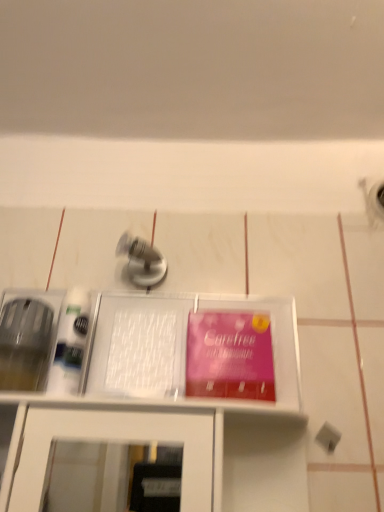
This screenshot has width=384, height=512. In order to click on satin nickel faucet at center in this screenshot , I will do `click(142, 260)`.

The height and width of the screenshot is (512, 384). What do you see at coordinates (160, 399) in the screenshot?
I see `white plastic tray at center` at bounding box center [160, 399].

Where is `satin nickel faucet at center`? This screenshot has width=384, height=512. satin nickel faucet at center is located at coordinates (142, 260).

Which of these two, satin nickel faucet at center or pink matte paper at center, is smaller?

pink matte paper at center.

Is satin nickel faucet at center directly adjacent to pink matte paper at center?

No, satin nickel faucet at center is not next to pink matte paper at center.

Measure the distance from satin nickel faucet at center to pink matte paper at center.

They are 7.96 inches apart.

How many degrees apart are the facing directions of satin nickel faucet at center and pink matte paper at center?

The angle between the facing direction of satin nickel faucet at center and the facing direction of pink matte paper at center is 0.884 degrees.

Can you confirm if white plastic tray at center is shorter than satin nickel faucet at center?

Incorrect, the height of white plastic tray at center does not fall short of that of satin nickel faucet at center.

In the scene shown: Is white plastic tray at center far away from satin nickel faucet at center?

No, white plastic tray at center is not far from satin nickel faucet at center.

In the image, there is a satin nickel faucet at center. Where is `furniture below it (from a real-world perspective)`? This screenshot has width=384, height=512. furniture below it (from a real-world perspective) is located at coordinates (160, 399).

Is white plastic tray at center facing away from satin nickel faucet at center?

No, white plastic tray at center's orientation is not away from satin nickel faucet at center.

Considering the relative sizes of white plastic tray at center and pink matte paper at center in the image provided, is white plastic tray at center thinner than pink matte paper at center?

No, white plastic tray at center is not thinner than pink matte paper at center.

The image size is (384, 512). In the image, there is a white plastic tray at center. Find the location of `paperback book below it (from a real-world perspective)`. paperback book below it (from a real-world perspective) is located at coordinates (229, 356).

Is white plastic tray at center placed right next to pink matte paper at center?

Yes, white plastic tray at center is with pink matte paper at center.

From the image's perspective, who appears lower, pink matte paper at center or white plastic tray at center?

pink matte paper at center, from the image's perspective.

Considering the relative sizes of pink matte paper at center and white plastic tray at center in the image provided, is pink matte paper at center bigger than white plastic tray at center?

No.

Find the location of a particular element. This screenshot has width=384, height=512. furniture above the pink matte paper at center (from the image's perspective) is located at coordinates (160, 399).

From the picture: Is pink matte paper at center at the right side of white plastic tray at center?

Yes.

Is pink matte paper at center oriented away from satin nickel faucet at center?

pink matte paper at center does not have its back to satin nickel faucet at center.

Based on their sizes in the image, would you say pink matte paper at center is bigger or smaller than satin nickel faucet at center?

In the image, pink matte paper at center appears to be smaller than satin nickel faucet at center.

Looking at this image, which is more to the right, pink matte paper at center or satin nickel faucet at center?

Positioned to the right is pink matte paper at center.

From the picture: From a real-world perspective, which object rests below the other?

From a 3D spatial view, white plastic tray at center is below.

Does satin nickel faucet at center turn towards white plastic tray at center?

No, satin nickel faucet at center is not facing towards white plastic tray at center.

Considering the sizes of objects satin nickel faucet at center and white plastic tray at center in the image provided, who is smaller, satin nickel faucet at center or white plastic tray at center?

satin nickel faucet at center is smaller.

Locate an element on the screen. This screenshot has width=384, height=512. tap behind the pink matte paper at center is located at coordinates (142, 260).

The height and width of the screenshot is (512, 384). In order to click on furniture on the right of satin nickel faucet at center in this screenshot , I will do `click(160, 399)`.

Which object lies further to the anchor point pink matte paper at center, white plastic tray at center or satin nickel faucet at center?

satin nickel faucet at center is positioned further to the anchor pink matte paper at center.

When comparing their distances from satin nickel faucet at center, does white plastic tray at center or pink matte paper at center seem closer?

The object closer to satin nickel faucet at center is pink matte paper at center.

From the image, which object appears to be nearer to white plastic tray at center, satin nickel faucet at center or pink matte paper at center?

pink matte paper at center lies closer to white plastic tray at center than the other object.

Based on their spatial positions, is pink matte paper at center or white plastic tray at center closer to satin nickel faucet at center?

pink matte paper at center lies closer to satin nickel faucet at center than the other object.

From the image, which object appears to be farther from white plastic tray at center, pink matte paper at center or satin nickel faucet at center?

satin nickel faucet at center.

Which object lies nearer to the anchor point pink matte paper at center, satin nickel faucet at center or white plastic tray at center?

The object closer to pink matte paper at center is white plastic tray at center.

Find the location of a particular element. The height and width of the screenshot is (512, 384). furniture between satin nickel faucet at center and pink matte paper at center vertically is located at coordinates (160, 399).